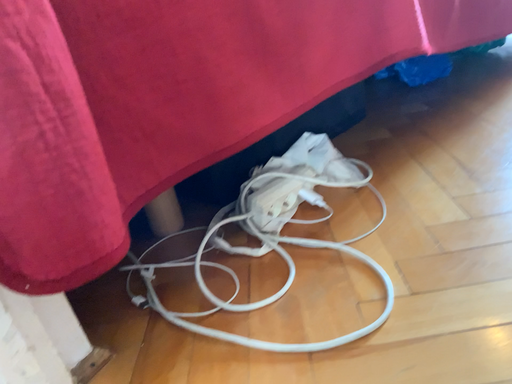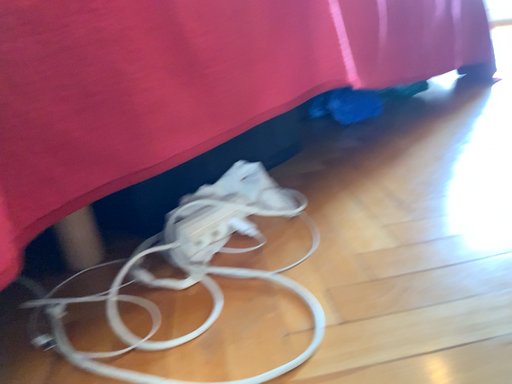
Question: How did the camera likely rotate when shooting the video?

Choices:
 (A) rotated left
 (B) rotated right

Answer: (B)